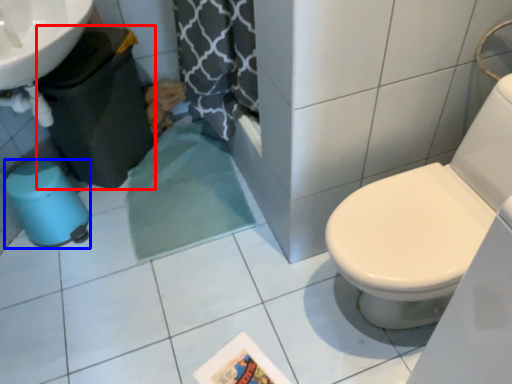
Question: Among these objects, which one is nearest to the camera, potty (highlighted by a red box) or potty (highlighted by a blue box)?

Choices:
 (A) potty
 (B) potty

Answer: (A)